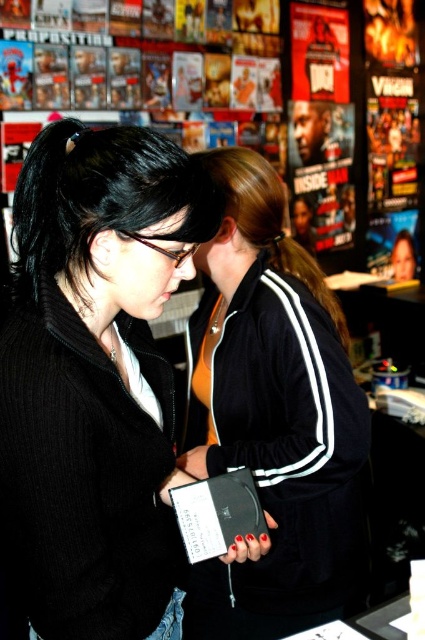
You are a store employee organizing jackets in the fitting room. You see the black matte jacket at center and the black velour jacket at center. Which one is placed higher on the rack?

The black matte jacket at center is located above the black velour jacket at center, so it is placed higher on the rack.

You are standing in a retail store looking at two points marked on the wall. The first point is at coordinates point (150,508) and the second point is at point (303,298). Which point is closer to your current position?

Point (150,508) is closer to the camera than point (303,298), so it is closer to your current position.

You are standing in a retail store and see a black matte jacket at center. Is there any object at the point with coordinates (96, 378)?

Yes, there is a black matte jacket at center located at point (96, 378).